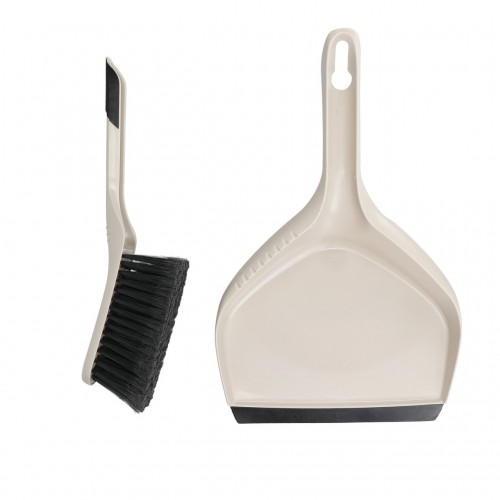
This screenshot has height=500, width=500. Find the location of `beige handle`. beige handle is located at coordinates (111, 162).